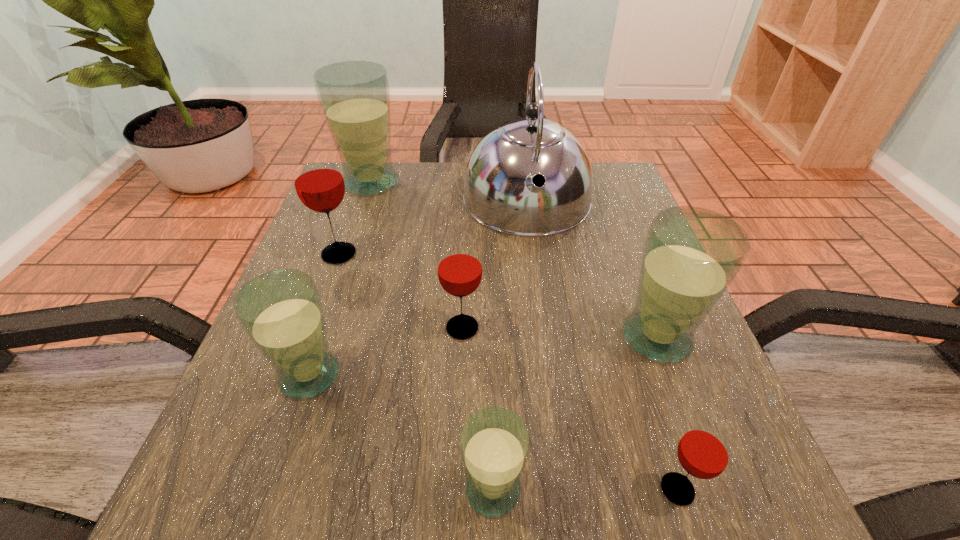
Locate an element on the screen. free location located 0.380m on the back of the smallest blue glass is located at coordinates (489, 271).

Image resolution: width=960 pixels, height=540 pixels. Identify the location of kettle that is at the far edge. (500, 193).

At what (x,y) coordinates should I click in order to perform the action: click on glass that is at the far edge. Please return your answer as a coordinate pair (x, y). This screenshot has height=540, width=960. Looking at the image, I should click on (354, 96).

Locate an element on the screen. Image resolution: width=960 pixels, height=540 pixels. kettle present at the right edge is located at coordinates (500, 193).

Image resolution: width=960 pixels, height=540 pixels. Find the location of `object at the far left corner`. object at the far left corner is located at coordinates (354, 96).

I want to click on object located at the far right corner, so click(500, 193).

You are a GUI agent. You are given a task and a screenshot of the screen. Output one action in this format:
    pyautogui.click(x=<x>, y=<y>)
    Task: Click on the object that is positioned at the near right corner
    The image size is (960, 540).
    Given the screenshot: What is the action you would take?
    pyautogui.click(x=705, y=450)

This screenshot has width=960, height=540. What are the coordinates of `blank area at the far edge` in the screenshot? It's located at (437, 163).

The width and height of the screenshot is (960, 540). In order to click on free point at the left edge in this screenshot , I will do `click(226, 454)`.

Locate an element on the screen. The height and width of the screenshot is (540, 960). vacant space at the far left corner of the desktop is located at coordinates (343, 208).